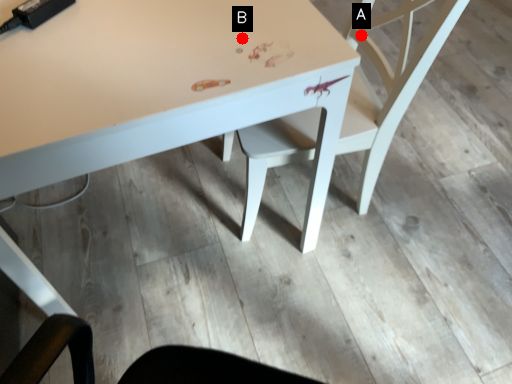
Question: Two points are circled on the image, labeled by A and B beside each circle. Which point appears closest to the camera in this image?

Choices:
 (A) A is closer
 (B) B is closer

Answer: (B)